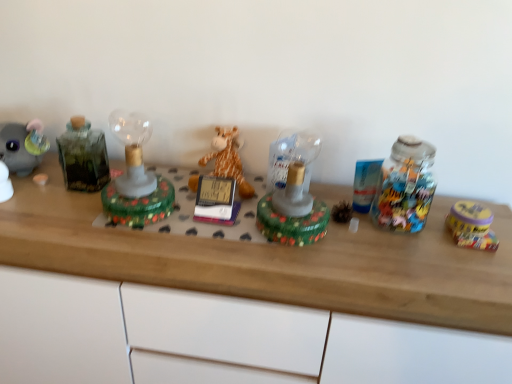
Question: Can you confirm if wooden desk at center is bigger than yellow matte tin at right, acting as the 4th toy starting from the left?

Choices:
 (A) no
 (B) yes

Answer: (B)

Question: Is wooden desk at center positioned with its back to yellow matte tin at right, the first toy when ordered from right to left?

Choices:
 (A) no
 (B) yes

Answer: (A)

Question: Can you confirm if wooden desk at center is taller than yellow matte tin at right, acting as the 4th toy starting from the left?

Choices:
 (A) no
 (B) yes

Answer: (B)

Question: Would you say wooden desk at center is a long distance from yellow matte tin at right, acting as the 4th toy starting from the left?

Choices:
 (A) no
 (B) yes

Answer: (A)

Question: From the image's perspective, does wooden desk at center appear higher than yellow matte tin at right, the first toy when ordered from right to left?

Choices:
 (A) no
 (B) yes

Answer: (A)

Question: From the image's perspective, is wooden desk at center above or below green glass bottle at left?

Choices:
 (A) above
 (B) below

Answer: (B)

Question: In terms of width, does wooden desk at center look wider or thinner when compared to green glass bottle at left?

Choices:
 (A) wide
 (B) thin

Answer: (A)

Question: Is point (409, 307) positioned closer to the camera than point (67, 187)?

Choices:
 (A) closer
 (B) farther

Answer: (A)

Question: Is wooden desk at center bigger or smaller than green glass bottle at left?

Choices:
 (A) small
 (B) big

Answer: (B)

Question: From a real-world perspective, relative to green glass lamp at center, which appears as the fourth toy when viewed from the right, is translucent glass lamp at center, the 2th toy positioned from the right, vertically above or below?

Choices:
 (A) below
 (B) above

Answer: (B)

Question: Considering the positions of point (287, 205) and point (145, 195), is point (287, 205) closer or farther from the camera than point (145, 195)?

Choices:
 (A) closer
 (B) farther

Answer: (A)

Question: Based on their positions, is translucent glass lamp at center, the 2th toy positioned from the right, located to the left or right of green glass lamp at center, which appears as the fourth toy when viewed from the right?

Choices:
 (A) left
 (B) right

Answer: (B)

Question: From the image's perspective, is translucent glass lamp at center, the 2th toy positioned from the right, located above or below green glass lamp at center, the 1th toy in the left-to-right sequence?

Choices:
 (A) below
 (B) above

Answer: (A)

Question: Relative to green glass bottle at left, is green glass lamp at center, the 1th toy in the left-to-right sequence, in front or behind?

Choices:
 (A) behind
 (B) front

Answer: (B)

Question: From a real-world perspective, is green glass lamp at center, which appears as the fourth toy when viewed from the right, physically located above or below green glass bottle at left?

Choices:
 (A) above
 (B) below

Answer: (B)